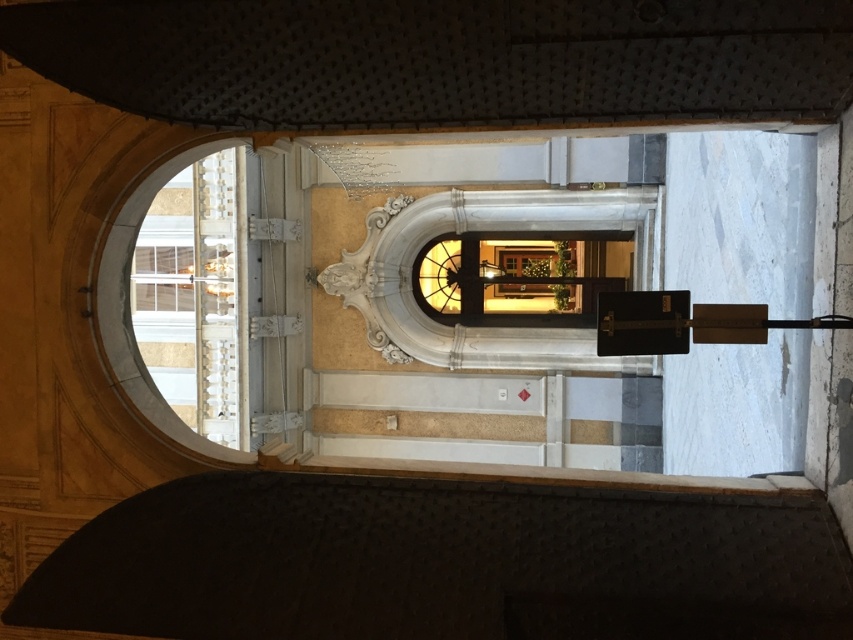
You are standing in the grand interior space and want to exit through the matte glass door at center. Which direction should you move relative to the white marble window at upper left?

You should move to the right of the white marble window at upper left to reach the matte glass door at center.

You are an interior designer planning to install a new lighting fixture between the matte glass door at center and the white marble window at upper left. The fixture requires a minimum of 40 meters of space between the two points to ensure proper installation. Can the space accommodate this requirement?

The matte glass door at center and white marble window at upper left are 42.97 meters apart, which exceeds the required 40 meters. Therefore, the space can accommodate the lighting fixture installation.

You are an interior designer planning to install a new fixture that requires a space of 2 meters in width. You have two options in the scene to place it between the matte glass door at center and the white marble window at upper left. Which object would you choose for placement?

The matte glass door at center has a larger width than the white marble window at upper left, so you should choose the matte glass door at center for placement since it can accommodate the 2 meter width requirement.